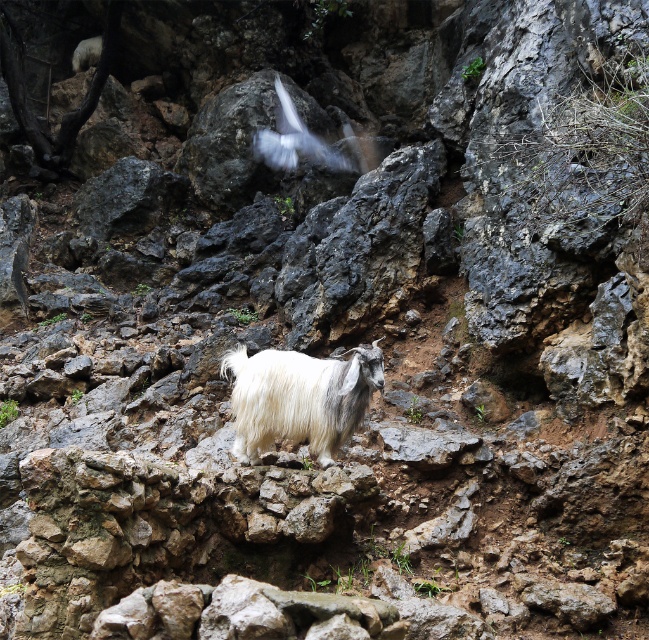
You are a hiker who wants to take a photo of the white woolen goat at center and the white fluffy bird at upper center. Which object should you focus on first if you want to capture both in the same frame without moving your camera?

The white woolen goat at center is positioned on the right side of the white fluffy bird at upper center. Since the goat is closer to the camera than the bird, you should focus on the white woolen goat at center first to ensure both are in focus.

You are a hiker who wants to take a photo of the white woolen goat at center and the white fluffy bird at upper center. Which animal should you focus on first to ensure both are in the frame?

The white woolen goat at center is in front of the white fluffy bird at upper center, so you should focus on the white woolen goat at center first to ensure both are in the frame.